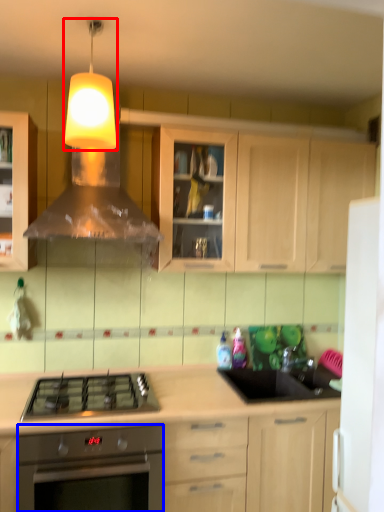
Question: Which object appears farthest to the camera in this image, light fixture (highlighted by a red box) or oven (highlighted by a blue box)?

Choices:
 (A) light fixture
 (B) oven

Answer: (B)